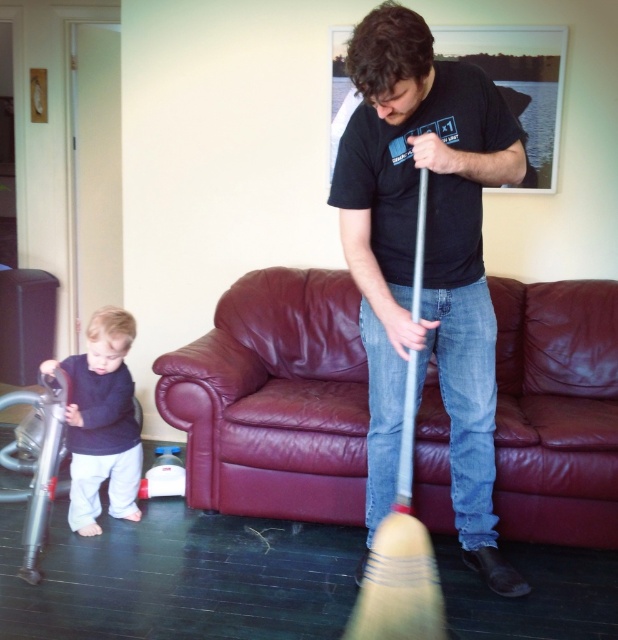
Who is positioned more to the left, black matte t-shirt at center or dark blue sweater at lower left?

dark blue sweater at lower left

Where is `black matte t-shirt at center`? The height and width of the screenshot is (640, 618). black matte t-shirt at center is located at coordinates (425, 257).

You are a GUI agent. You are given a task and a screenshot of the screen. Output one action in this format:
    pyautogui.click(x=<x>, y=<y>)
    Task: Click on the black matte t-shirt at center
    This screenshot has height=640, width=618.
    Given the screenshot: What is the action you would take?
    tap(425, 257)